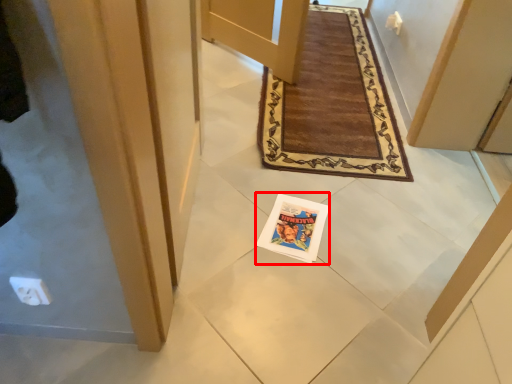
Question: From the image, what is the correct spatial relationship of magazine (annotated by the red box) in relation to door?

Choices:
 (A) right
 (B) left

Answer: (B)